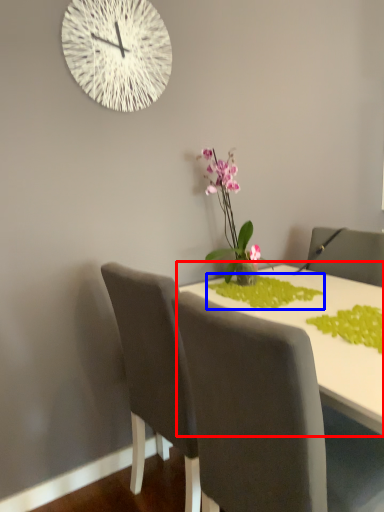
Question: Which object appears closest to the camera in this image, table (highlighted by a red box) or plant (highlighted by a blue box)?

Choices:
 (A) table
 (B) plant

Answer: (A)